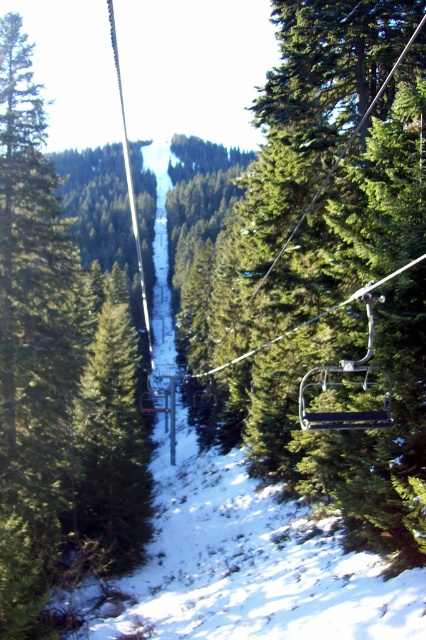
Who is positioned more to the left, green matte chair at center or green matte tree at center?

From the viewer's perspective, green matte tree at center appears more on the left side.

Which is in front, point (377, 211) or point (3, 356)?

Point (377, 211)

Is point (356, 211) farther from viewer compared to point (120, 529)?

No, it is not.

Identify the location of green matte chair at center. This screenshot has height=640, width=426. (322, 262).